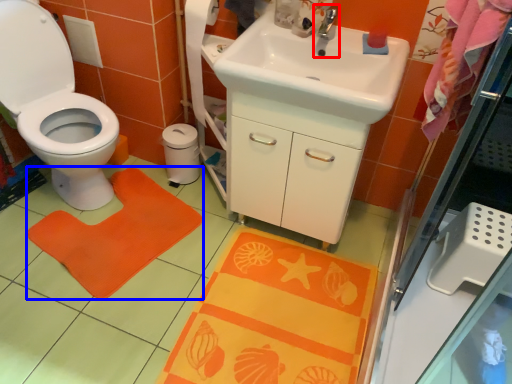
Question: Which object is further to the camera taking this photo, tap (highlighted by a red box) or doormat (highlighted by a blue box)?

Choices:
 (A) tap
 (B) doormat

Answer: (B)